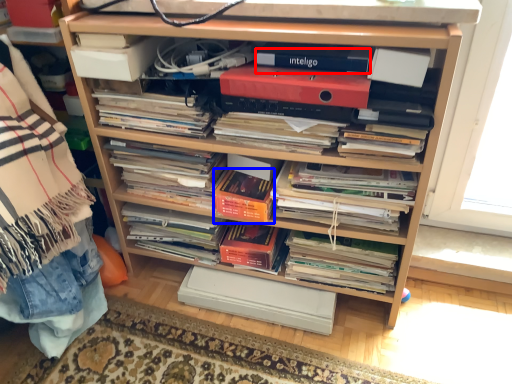
Question: Which object is further to the camera taking this photo, paperback book (highlighted by a red box) or paperback book (highlighted by a blue box)?

Choices:
 (A) paperback book
 (B) paperback book

Answer: (B)